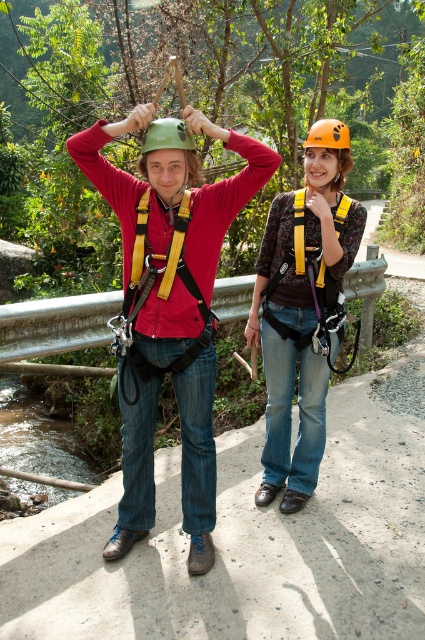
You are a safety inspector assessing the equipment in this image. You notice two helmets, the green matte helmet at center and the orange matte helmet at upper center. Which helmet has a greater height?

The green matte helmet at center is taller than the orange matte helmet at upper center according to the description.

You are a safety inspector checking the equipment of two adventurers. You notice the matte orange helmet at center and the green matte helmet at center. Which helmet has a larger size?

The matte orange helmet at center is larger in size than the green matte helmet at center.

Consider the image. You are planning to buy a helmet for your adventure gear. You see two helmets in the image, the matte green helmet at upper left and the green matte helmet at center. Which one has a wider width?

The matte green helmet at upper left has a wider width than the green matte helmet at center.